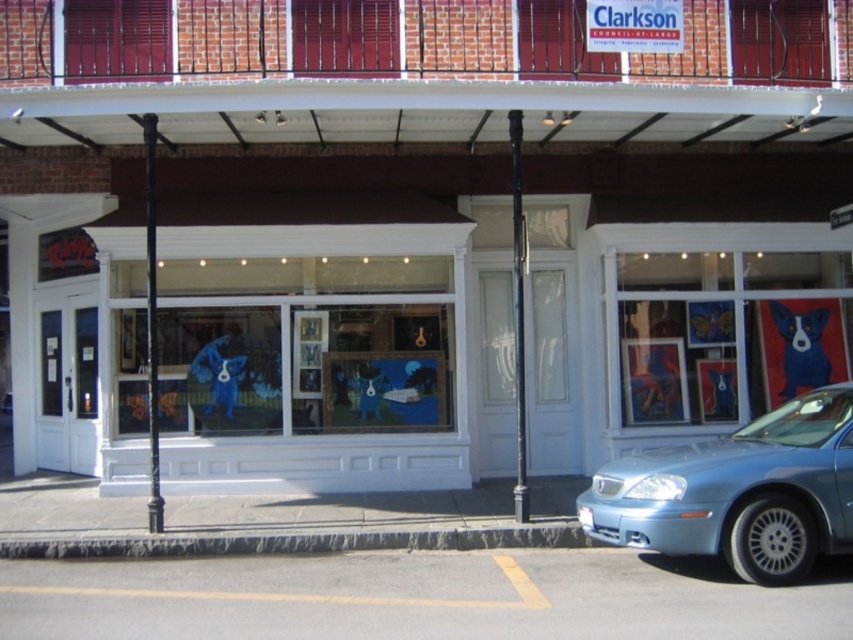
Question: Which object is closer to the camera taking this photo?

Choices:
 (A) blue glossy dog at center
 (B) light blue metallic car at lower right

Answer: (B)

Question: Is the position of matte glass window at center less distant than that of light blue metallic car at lower right?

Choices:
 (A) yes
 (B) no

Answer: (B)

Question: Estimate the real-world distances between objects in this image. Which object is closer to the blue glossy dog at center?

Choices:
 (A) matte glass window at center
 (B) light blue metallic car at lower right

Answer: (B)

Question: Where is matte glass window at center located in relation to blue glossy dog at center in the image?

Choices:
 (A) below
 (B) above

Answer: (A)

Question: Which point is closer to the camera?

Choices:
 (A) light blue metallic car at lower right
 (B) matte glass window at center

Answer: (A)

Question: Is light blue metallic car at lower right below blue glossy dog at center?

Choices:
 (A) yes
 (B) no

Answer: (A)